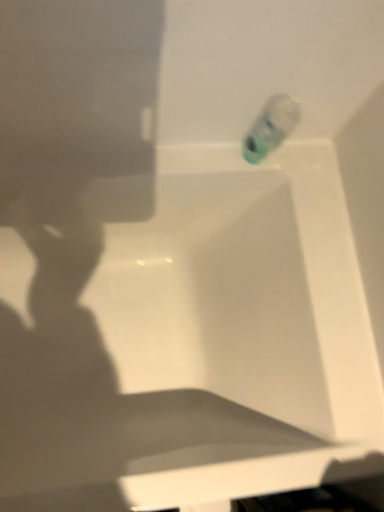
What do you see at coordinates (271, 127) in the screenshot?
I see `translucent plastic bottle at upper right` at bounding box center [271, 127].

Measure the distance between translucent plastic bottle at upper right and camera.

translucent plastic bottle at upper right is 31.50 inches from camera.

What is the approximate height of translucent plastic bottle at upper right?

It is 8.01 inches.

Image resolution: width=384 pixels, height=512 pixels. Identify the location of translucent plastic bottle at upper right. (271, 127).

This screenshot has width=384, height=512. I want to click on white glossy bathtub at upper center, so click(187, 334).

This screenshot has height=512, width=384. What do you see at coordinates (187, 334) in the screenshot?
I see `white glossy bathtub at upper center` at bounding box center [187, 334].

Identify the location of translucent plastic bottle at upper right. This screenshot has height=512, width=384. [x=271, y=127].

Considering the relative positions of translucent plastic bottle at upper right and white glossy bathtub at upper center in the image provided, is translucent plastic bottle at upper right to the left or to the right of white glossy bathtub at upper center?

Clearly, translucent plastic bottle at upper right is on the right of white glossy bathtub at upper center in the image.

Relative to white glossy bathtub at upper center, is translucent plastic bottle at upper right in front or behind?

Visually, translucent plastic bottle at upper right is located behind white glossy bathtub at upper center.

Which is further, (247, 161) or (34, 506)?

The point (247, 161) is farther.

From the image's perspective, which one is positioned lower, translucent plastic bottle at upper right or white glossy bathtub at upper center?

white glossy bathtub at upper center, from the image's perspective.

From a real-world perspective, is translucent plastic bottle at upper right over white glossy bathtub at upper center?

Yes, from a real-world perspective, translucent plastic bottle at upper right is on top of white glossy bathtub at upper center.

Considering the sizes of translucent plastic bottle at upper right and white glossy bathtub at upper center in the image, is translucent plastic bottle at upper right wider or thinner than white glossy bathtub at upper center?

Considering their sizes, translucent plastic bottle at upper right looks slimmer than white glossy bathtub at upper center.

Between translucent plastic bottle at upper right and white glossy bathtub at upper center, which one has less height?

translucent plastic bottle at upper right.

Can you confirm if translucent plastic bottle at upper right is smaller than white glossy bathtub at upper center?

Indeed, translucent plastic bottle at upper right has a smaller size compared to white glossy bathtub at upper center.

Can white glossy bathtub at upper center be found inside translucent plastic bottle at upper right?

No, translucent plastic bottle at upper right does not contain white glossy bathtub at upper center.

Does translucent plastic bottle at upper right touch white glossy bathtub at upper center?

No, translucent plastic bottle at upper right is not with white glossy bathtub at upper center.

Is translucent plastic bottle at upper right turned away from white glossy bathtub at upper center?

No, white glossy bathtub at upper center is not at the back of translucent plastic bottle at upper right.

How much distance is there between translucent plastic bottle at upper right and white glossy bathtub at upper center?

They are 17.46 inches apart.

Locate an element on the screen. The image size is (384, 512). bathtub beneath the translucent plastic bottle at upper right (from a real-world perspective) is located at coordinates (187, 334).

Visually, is white glossy bathtub at upper center positioned to the left or to the right of translucent plastic bottle at upper right?

Clearly, white glossy bathtub at upper center is on the left of translucent plastic bottle at upper right in the image.

Between white glossy bathtub at upper center and translucent plastic bottle at upper right, which one is positioned behind?

Positioned behind is translucent plastic bottle at upper right.

Is point (193, 379) positioned before point (256, 127)?

No, (193, 379) is behind (256, 127).

From the image's perspective, who appears lower, white glossy bathtub at upper center or translucent plastic bottle at upper right?

white glossy bathtub at upper center.

From a real-world perspective, between white glossy bathtub at upper center and translucent plastic bottle at upper right, who is vertically lower?

white glossy bathtub at upper center, from a real-world perspective.

Can you confirm if white glossy bathtub at upper center is wider than translucent plastic bottle at upper right?

Correct, the width of white glossy bathtub at upper center exceeds that of translucent plastic bottle at upper right.

Is white glossy bathtub at upper center taller or shorter than translucent plastic bottle at upper right?

Clearly, white glossy bathtub at upper center is taller compared to translucent plastic bottle at upper right.

Is white glossy bathtub at upper center smaller than translucent plastic bottle at upper right?

No.

Can we say white glossy bathtub at upper center lies outside translucent plastic bottle at upper right?

white glossy bathtub at upper center lies outside translucent plastic bottle at upper right's area.

Is white glossy bathtub at upper center with translucent plastic bottle at upper right?

There is a gap between white glossy bathtub at upper center and translucent plastic bottle at upper right.

Is white glossy bathtub at upper center positioned with its back to translucent plastic bottle at upper right?

No, white glossy bathtub at upper center's orientation is not away from translucent plastic bottle at upper right.

Where is `bathtub below the translucent plastic bottle at upper right (from the image's perspective)`? The image size is (384, 512). bathtub below the translucent plastic bottle at upper right (from the image's perspective) is located at coordinates (187, 334).

This screenshot has height=512, width=384. In order to click on liquid behind the white glossy bathtub at upper center in this screenshot , I will do `click(271, 127)`.

At what (x,y) coordinates should I click in order to perform the action: click on bathtub that is on the left side of translucent plastic bottle at upper right. Please return your answer as a coordinate pair (x, y). Looking at the image, I should click on (187, 334).